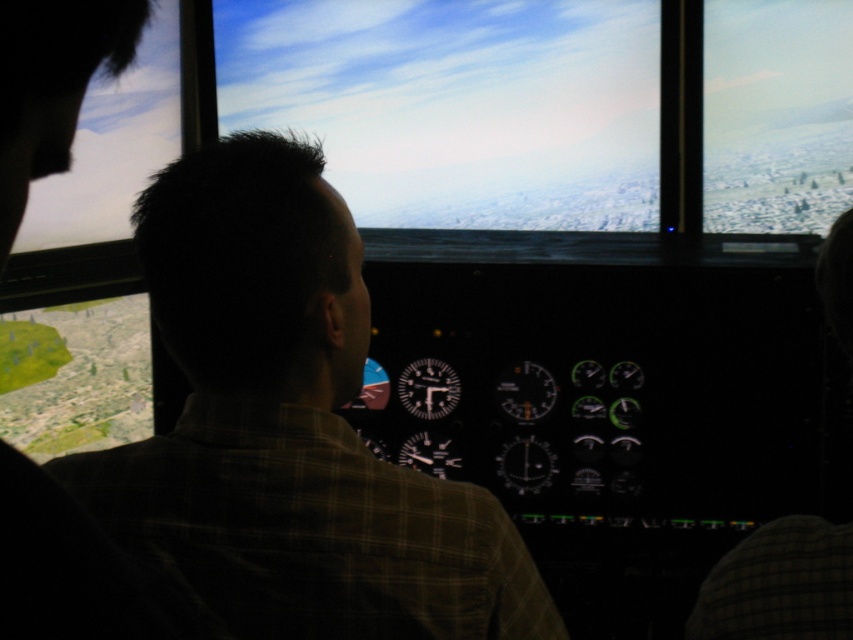
Question: Which point is farther to the camera?

Choices:
 (A) cloudy sky at center
 (B) brown plaid shirt at center

Answer: (A)

Question: Is brown plaid shirt at center bigger than cloudy sky at center?

Choices:
 (A) yes
 (B) no

Answer: (B)

Question: Does brown plaid shirt at center appear under cloudy sky at center?

Choices:
 (A) no
 (B) yes

Answer: (B)

Question: Among these points, which one is nearest to the camera?

Choices:
 (A) (561, 170)
 (B) (222, 452)

Answer: (B)

Question: From the image, what is the correct spatial relationship of brown plaid shirt at center in relation to cloudy sky at center?

Choices:
 (A) above
 (B) below

Answer: (B)